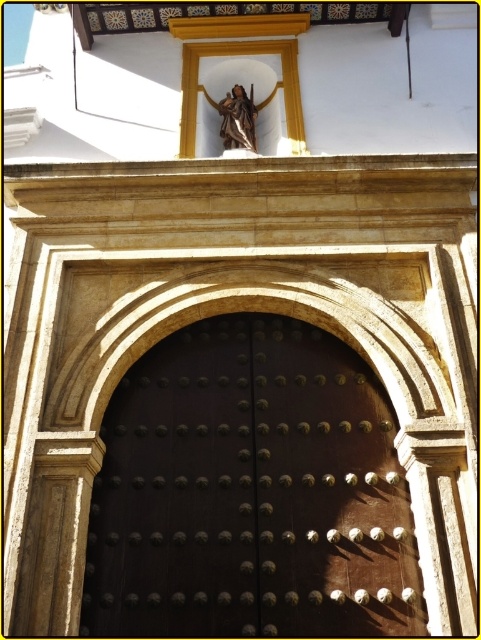
You are an architect assessing the building entrance. You need to determine if a new decorative banner, which is 2 meters tall, can be hung between the dark polished wood door at center and the matte bronze statue at upper center without overlapping either. Given their heights, is this possible?

The dark polished wood door at center is taller than the matte bronze statue at upper center. Since the banner is 2 meters tall, it can be hung between them as long as the space between their heights accommodates the banner. However, the exact feasibility depends on the actual height measurements of the door and statue, which are not provided here.

Based on the photo, you are an architect designing a new building entrance. You want to ensure that the dark polished wood door at center and the matte bronze statue at upper center are proportionally balanced. Given that the door is wider than the statue, how should you adjust the statue to maintain visual harmony?

Since the dark polished wood door at center is wider than the matte bronze statue at upper center, you should increase the height of the matte bronze statue at upper center to balance the proportions.